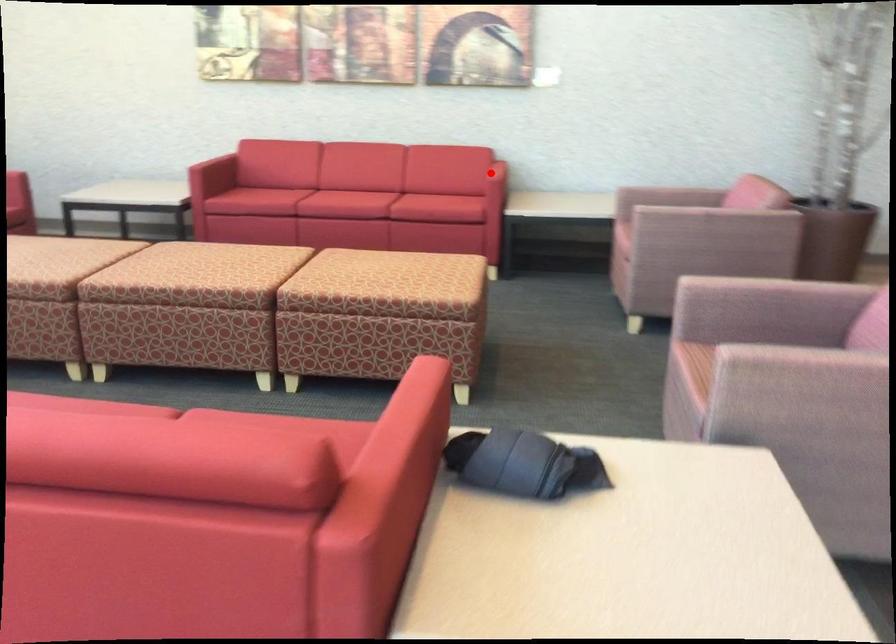
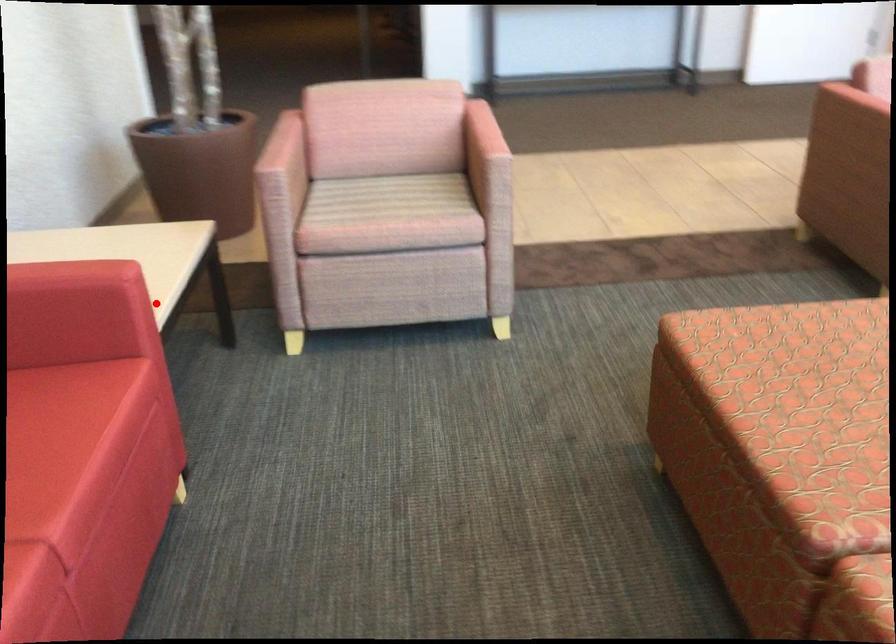
I am providing you with two images of the same scene from different viewpoints. A red point is marked on the first image and another point is marked on the second image. Does the point marked in image1 correspond to the same location as the one in image2?

Yes